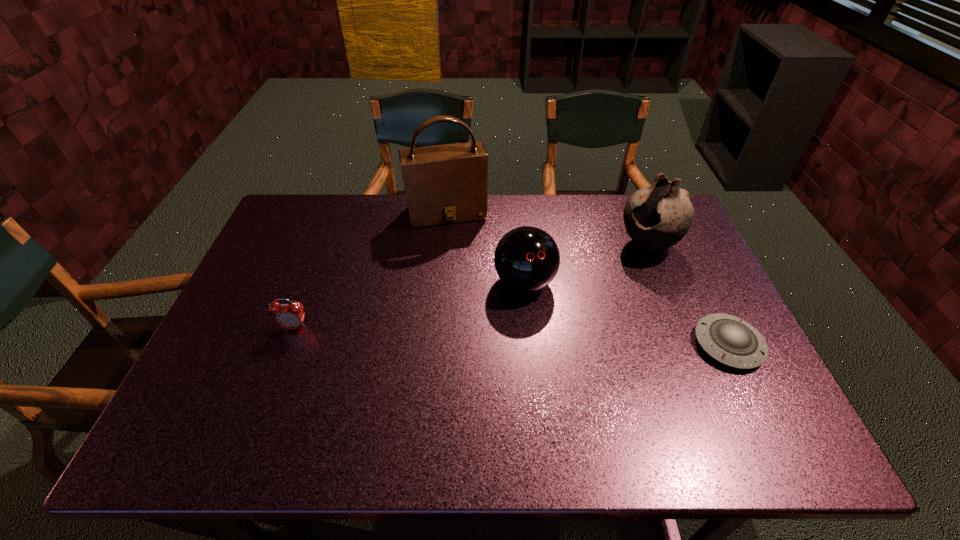
In the image, there is a desktop. Where is `vacant space at the near left corner`? vacant space at the near left corner is located at coordinates (210, 398).

Locate an element on the screen. The image size is (960, 540). vacant area that lies between the third tallest object and the fourth tallest object is located at coordinates (410, 305).

Locate an element on the screen. This screenshot has width=960, height=540. empty space that is in between the alarm clock and the bowling ball is located at coordinates (410, 305).

Locate an element on the screen. This screenshot has width=960, height=540. vacant space that is in between the third object from right to left and the fourth shortest object is located at coordinates (586, 264).

Find the location of a particular element. The height and width of the screenshot is (540, 960). unoccupied area between the second shortest object and the shoulder bag is located at coordinates (371, 271).

Where is `free spot between the tallest object and the saucer`? The height and width of the screenshot is (540, 960). free spot between the tallest object and the saucer is located at coordinates (588, 279).

Find the location of a particular element. The image size is (960, 540). unoccupied position between the second tallest object and the bowling ball is located at coordinates (586, 264).

In order to click on empty space between the bowling ball and the shortest object in this screenshot , I will do `click(626, 313)`.

Image resolution: width=960 pixels, height=540 pixels. What are the coordinates of `vacant area that lies between the leftmost object and the third object from right to left` in the screenshot? It's located at (410, 305).

Identify the location of blank region between the pottery and the leftmost object. (471, 286).